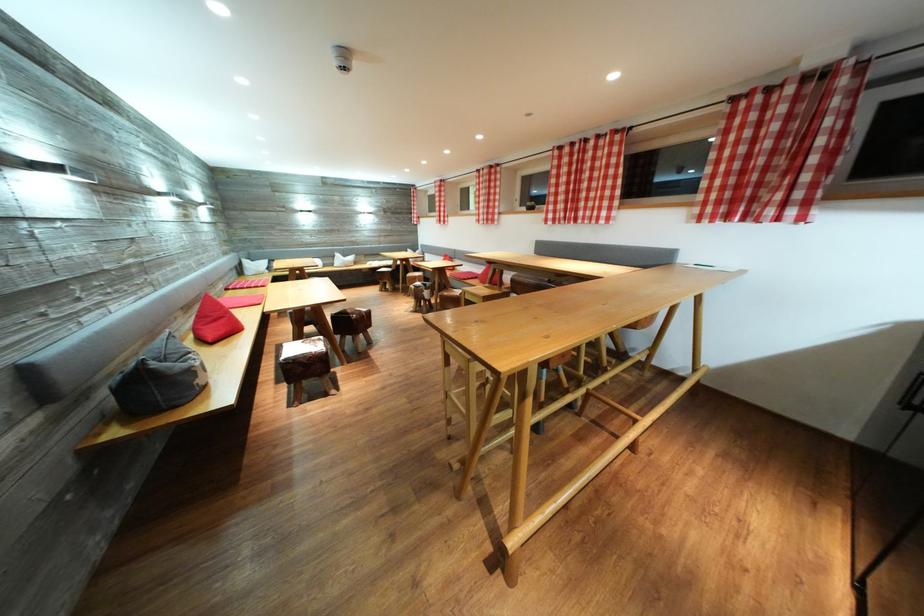
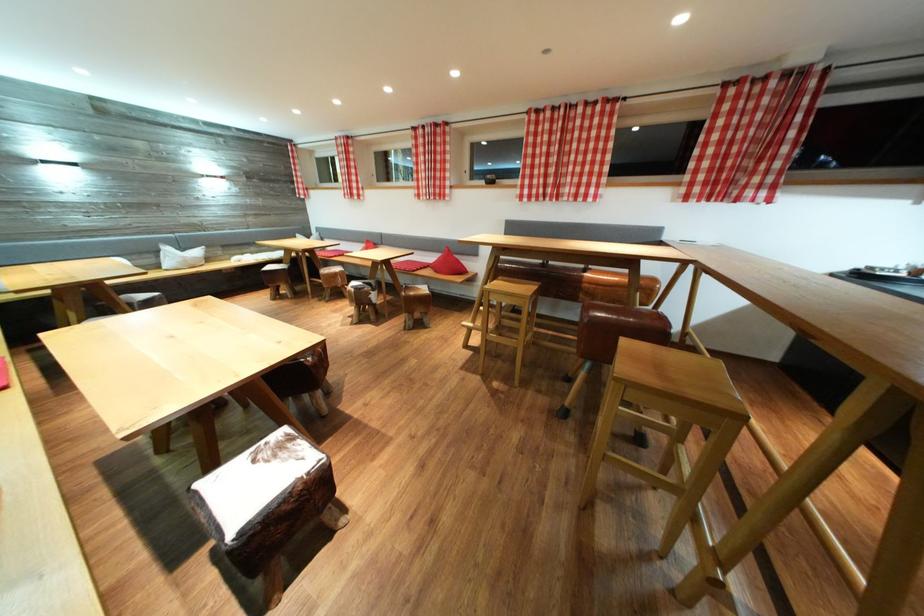
In the second image, find the point that corresponds to the point at 321,346 in the first image.

(286, 452)